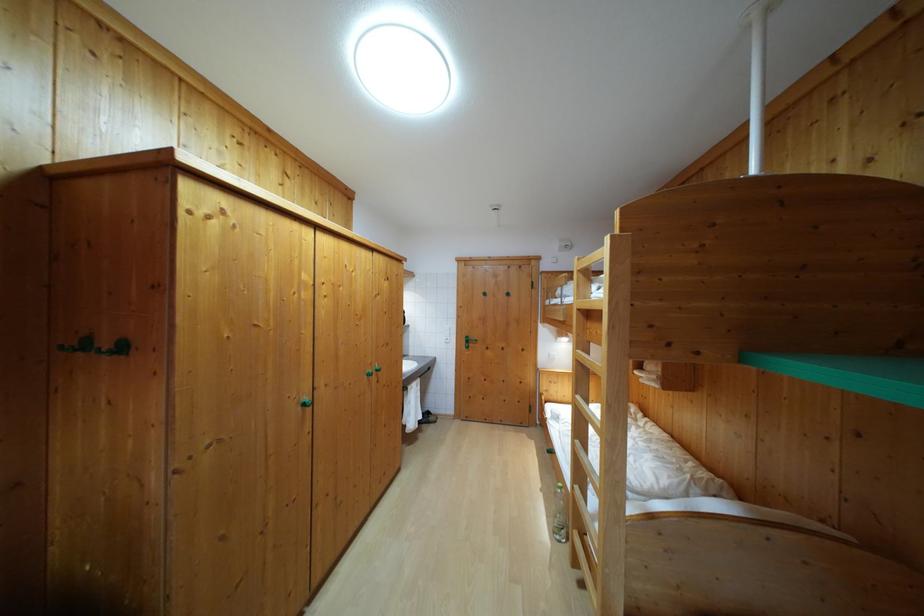
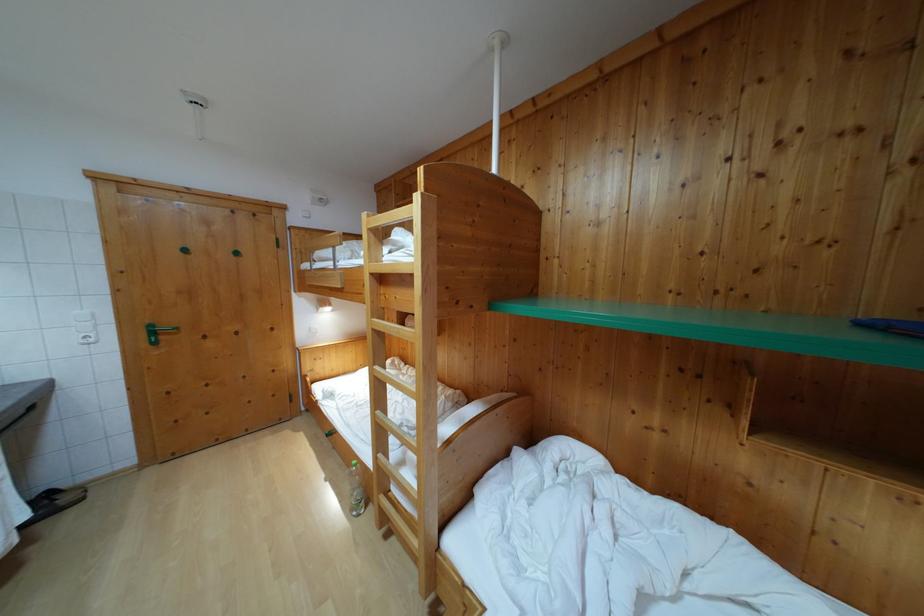
Locate, in the second image, the point that corresponds to point 582,267 in the first image.

(371, 223)